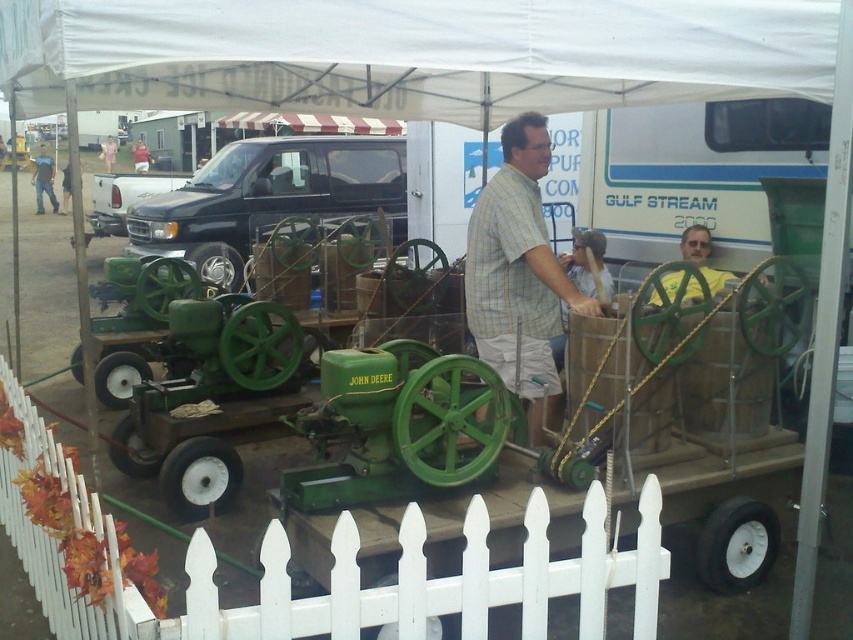
Who is higher up, white picket fence at center or checkered fabric shirt at center?

checkered fabric shirt at center

Between white picket fence at center and checkered fabric shirt at center, which one appears on the left side from the viewer's perspective?

white picket fence at center

The width and height of the screenshot is (853, 640). What do you see at coordinates (337, 570) in the screenshot? I see `white picket fence at center` at bounding box center [337, 570].

In order to click on white picket fence at center in this screenshot , I will do `click(337, 570)`.

Is white picket fence at center to the left of brushed metal shirt at upper left from the viewer's perspective?

In fact, white picket fence at center is to the right of brushed metal shirt at upper left.

The height and width of the screenshot is (640, 853). In order to click on white picket fence at center in this screenshot , I will do `click(337, 570)`.

Based on the photo, does checkered fabric shirt at center come in front of brushed metal shirt at upper left?

Yes, it is in front of brushed metal shirt at upper left.

Between point (550, 339) and point (33, 161), which one is positioned behind?

Positioned behind is point (33, 161).

Describe the element at coordinates (518, 273) in the screenshot. The image size is (853, 640). I see `checkered fabric shirt at center` at that location.

The image size is (853, 640). In order to click on checkered fabric shirt at center in this screenshot , I will do `click(518, 273)`.